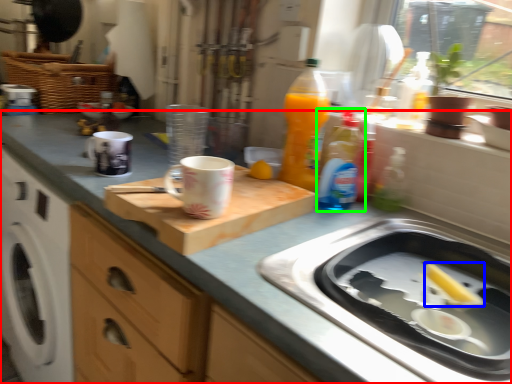
Question: Based on their relative distances, which object is farther from countertop (highlighted by a red box)? Choose from food (highlighted by a blue box) and bottle (highlighted by a green box).

Choices:
 (A) food
 (B) bottle

Answer: (A)